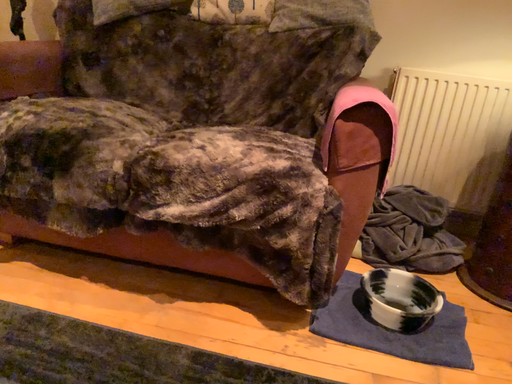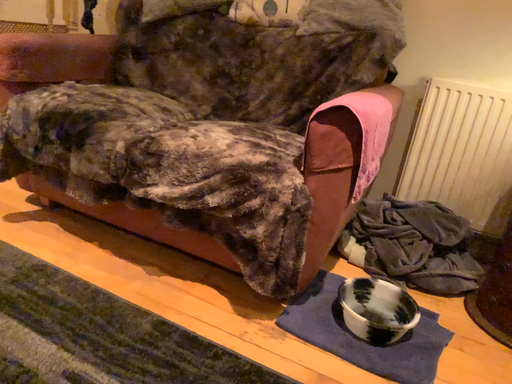
Question: Which way did the camera rotate in the video?

Choices:
 (A) rotated left
 (B) rotated right

Answer: (A)